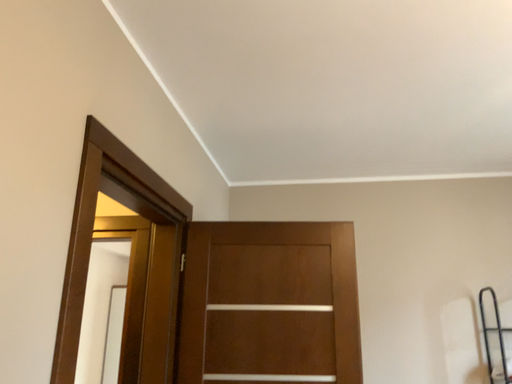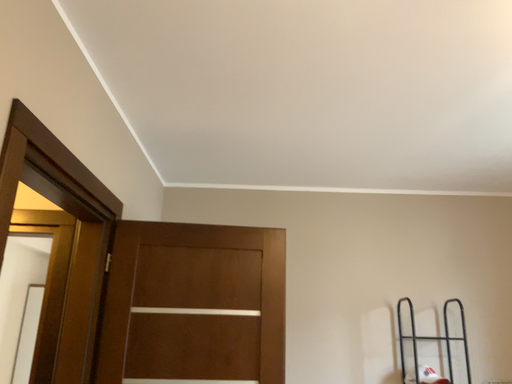
Question: Which way did the camera rotate in the video?

Choices:
 (A) rotated right
 (B) rotated left

Answer: (A)